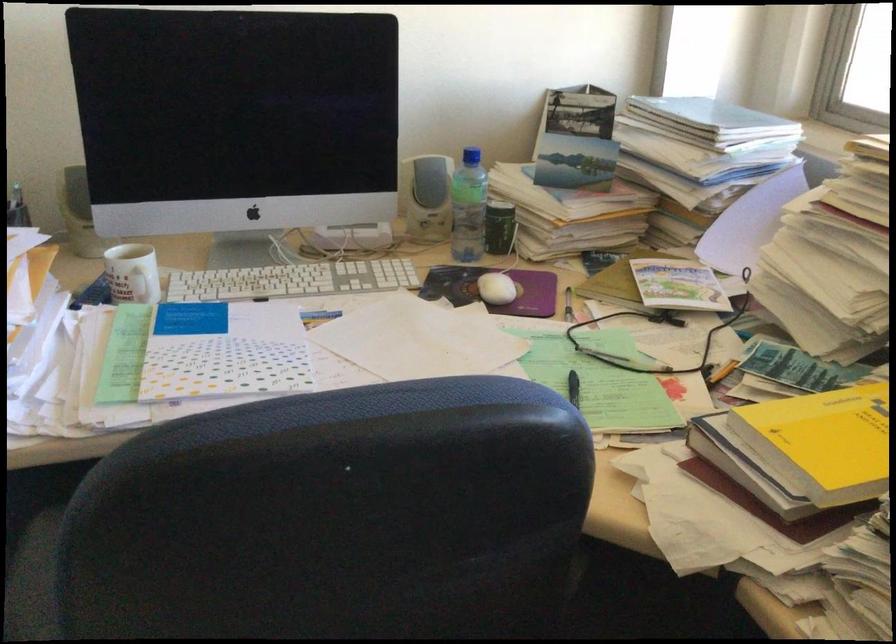
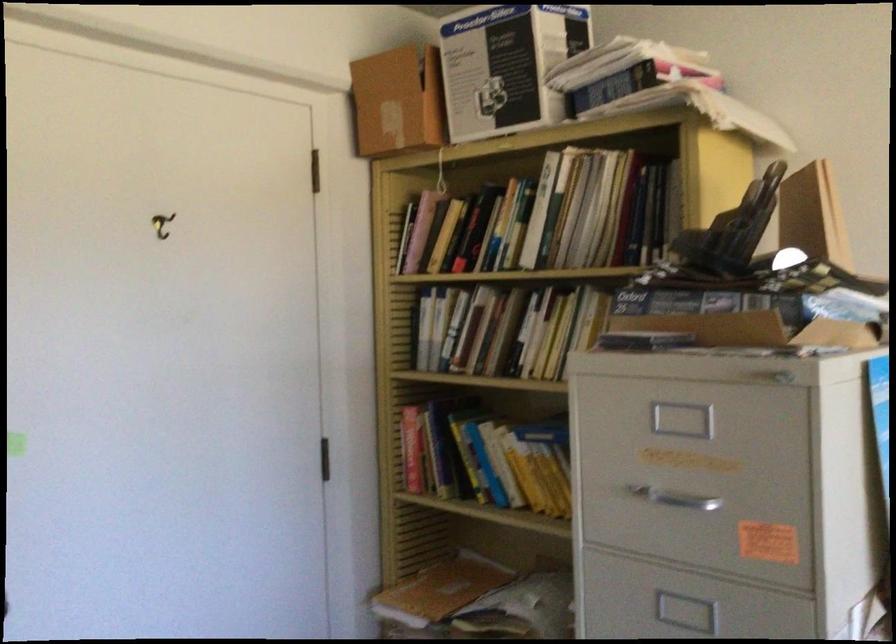
Question: The camera is either moving clockwise (left) or counter-clockwise (right) around the object. The first image is from the beginning of the video and the second image is from the end. Is the camera moving left or right when shooting the video?

Choices:
 (A) Left
 (B) Right

Answer: (B)